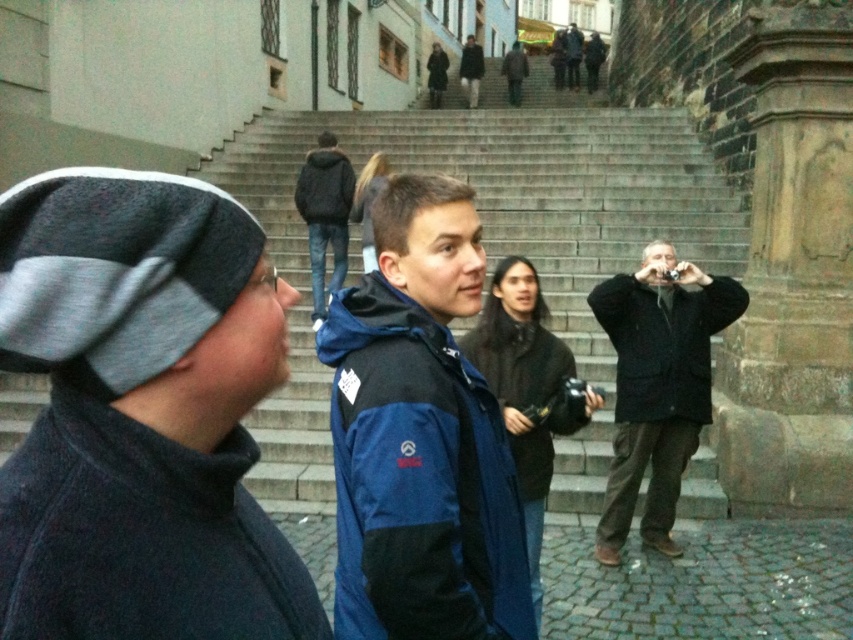
Question: Which of these objects is positioned closest to the dark gray jacket at upper center?

Choices:
 (A) black woolen jacket at center
 (B) black fuzzy jacket at upper center
 (C) dark gray fleece beanie at left

Answer: (B)

Question: Among these objects, which one is farthest from the camera?

Choices:
 (A) brown leather jacket at center
 (B) black matte sweatshirt at right
 (C) dark gray fleece sweatshirt at upper center

Answer: (A)

Question: Is black woolen jacket at center behind black matte sweatshirt at right?

Choices:
 (A) no
 (B) yes

Answer: (B)

Question: Can you confirm if dark gray fleece sweatshirt at upper center is bigger than brown leather jacket at center?

Choices:
 (A) yes
 (B) no

Answer: (B)

Question: Which of the following is the closest to the observer?

Choices:
 (A) black woolen jacket at center
 (B) blue fabric jacket at center
 (C) black matte sweatshirt at center
 (D) dark gray fleece beanie at left

Answer: (D)

Question: Is black woolen jacket at center below dark gray fleece sweatshirt at upper center?

Choices:
 (A) yes
 (B) no

Answer: (A)